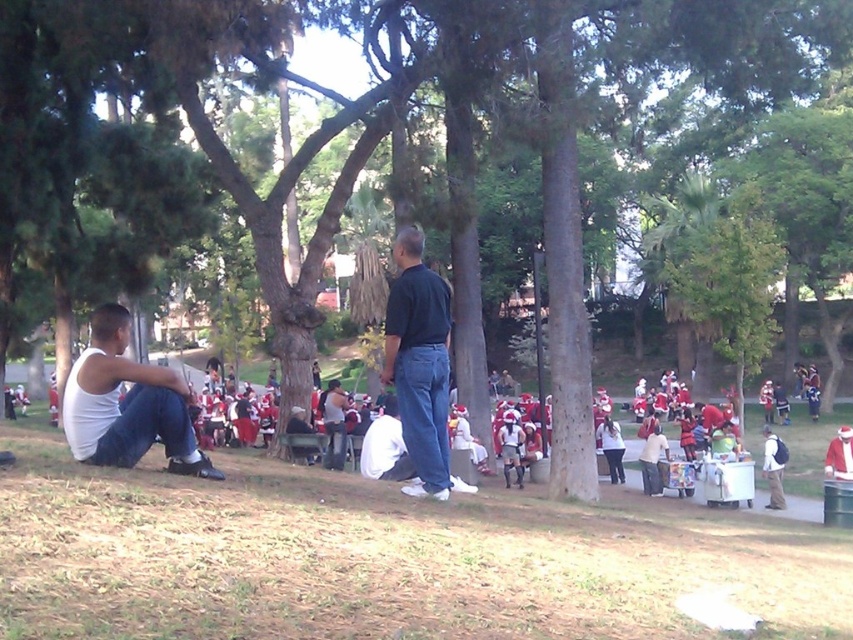
Question: Estimate the real-world distances between objects in this image. Which object is farther from the black matte shirt at center?

Choices:
 (A) white matte shirt at lower right
 (B) white matte uniform at center

Answer: (A)

Question: Which point is closer to the camera?

Choices:
 (A) (618, 465)
 (B) (662, 435)

Answer: (B)

Question: Can you confirm if white matte tank top at left is positioned above white matte jacket at lower right?

Choices:
 (A) no
 (B) yes

Answer: (B)

Question: Which object appears farthest from the camera in this image?

Choices:
 (A) white matte shirt at lower right
 (B) white matte tank top at left

Answer: (A)

Question: Does white matte shirt at lower right appear on the right side of white matte uniform at center?

Choices:
 (A) yes
 (B) no

Answer: (A)

Question: Is white matte shirt at lower right bigger than white matte uniform at center?

Choices:
 (A) no
 (B) yes

Answer: (A)